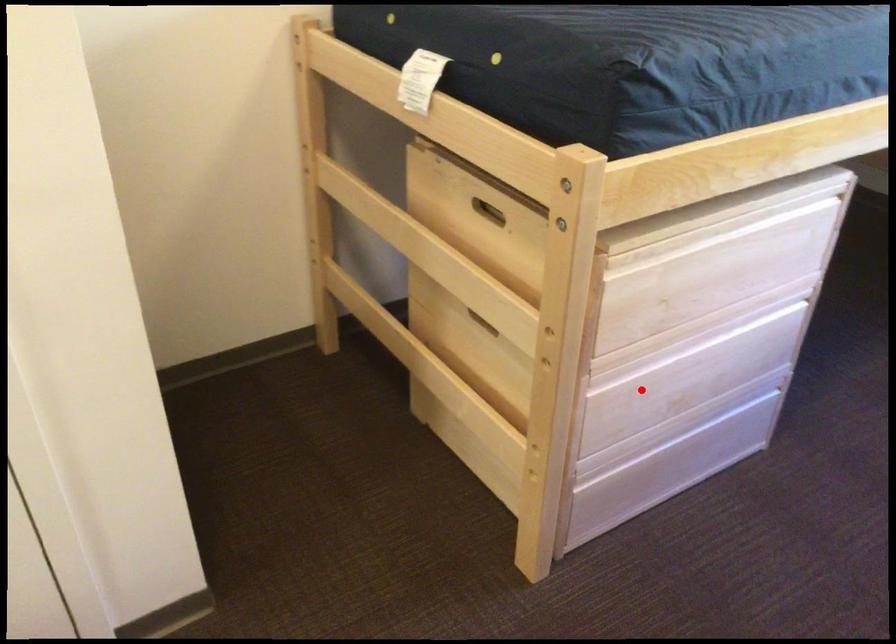
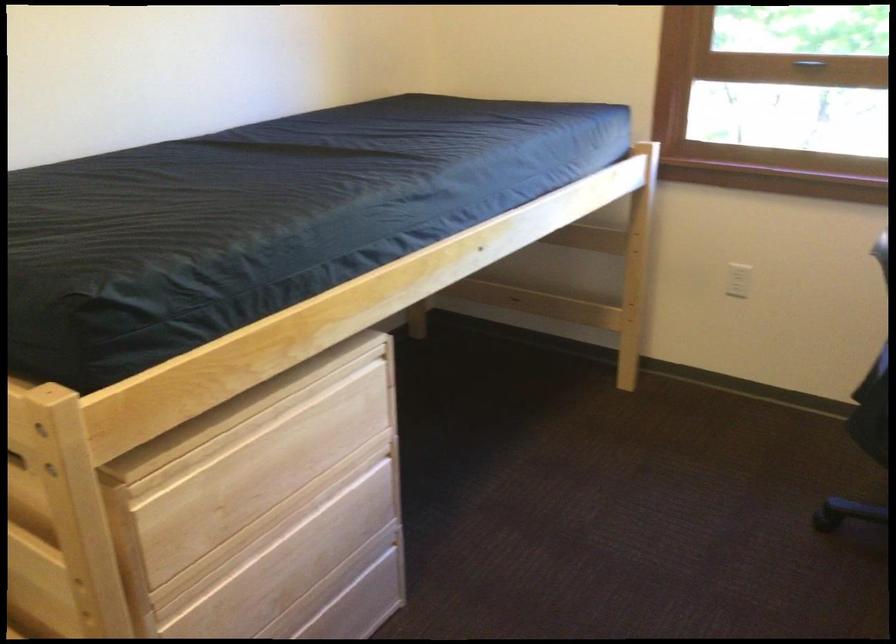
Locate, in the second image, the point that corresponds to the highlighted location in the first image.

(230, 601)